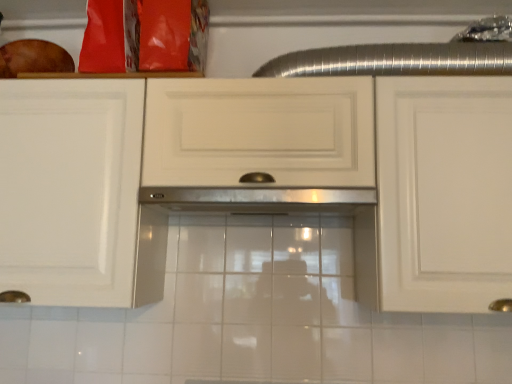
Question: In the image, is white glossy cabinet at center on the left side or the right side of stainless steel exhaust hood at center?

Choices:
 (A) right
 (B) left

Answer: (B)

Question: Relative to stainless steel exhaust hood at center, is white glossy cabinet at center in front or behind?

Choices:
 (A) behind
 (B) front

Answer: (B)

Question: From the image's perspective, relative to stainless steel exhaust hood at center, is white glossy cabinet at center above or below?

Choices:
 (A) above
 (B) below

Answer: (A)

Question: Considering their positions, is stainless steel exhaust hood at center located in front of or behind white glossy cabinet at center?

Choices:
 (A) front
 (B) behind

Answer: (B)

Question: From the image's perspective, is stainless steel exhaust hood at center above or below white glossy cabinet at center?

Choices:
 (A) below
 (B) above

Answer: (A)

Question: Considering the positions of point (174, 195) and point (243, 127), is point (174, 195) closer or farther from the camera than point (243, 127)?

Choices:
 (A) closer
 (B) farther

Answer: (B)

Question: Would you say stainless steel exhaust hood at center is to the left or to the right of white glossy cabinet at center in the picture?

Choices:
 (A) right
 (B) left

Answer: (A)